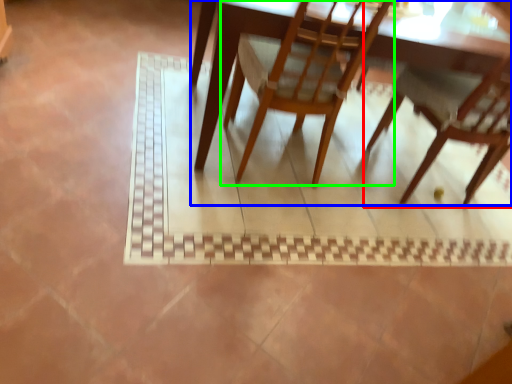
Question: Estimate the real-world distances between objects in this image. Which object is farther from chair (highlighted by a red box), table (highlighted by a blue box) or chair (highlighted by a green box)?

Choices:
 (A) table
 (B) chair

Answer: (A)